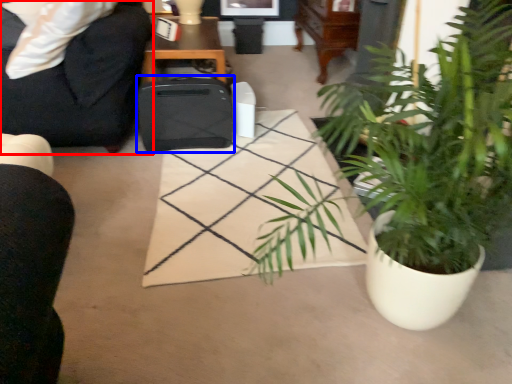
Question: Which point is closer to the camera, chair (highlighted by a red box) or luggage (highlighted by a blue box)?

Choices:
 (A) chair
 (B) luggage

Answer: (A)